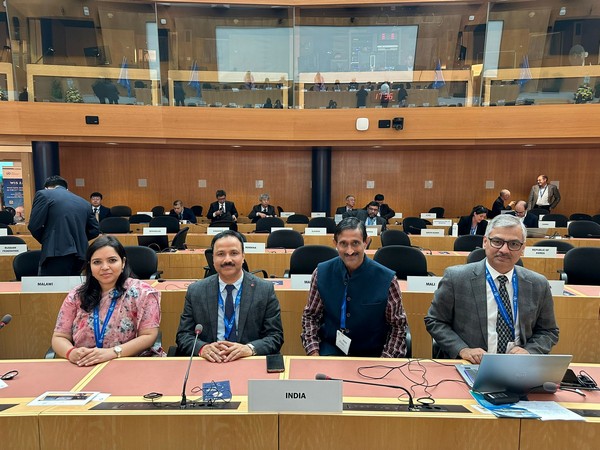
Image resolution: width=600 pixels, height=450 pixels. Find the location of `pillars of the hall`. pillars of the hall is located at coordinates (315, 181), (44, 157).